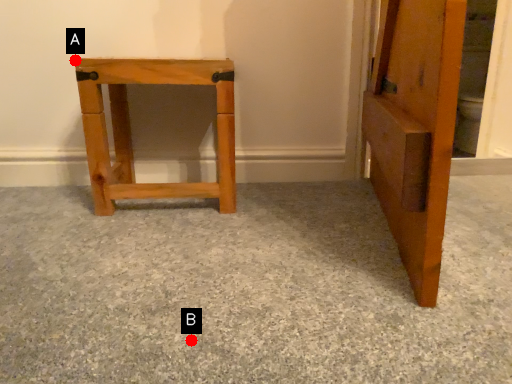
Question: Two points are circled on the image, labeled by A and B beside each circle. Which point is closer to the camera?

Choices:
 (A) A is closer
 (B) B is closer

Answer: (B)